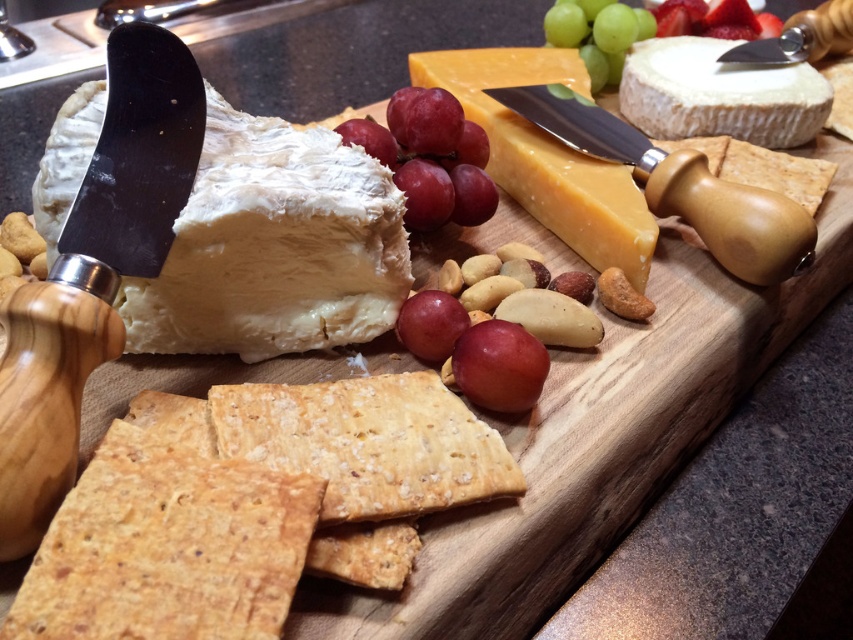
Is hard yellow cheese at center bigger than green matte grape at upper center?

Correct, hard yellow cheese at center is larger in size than green matte grape at upper center.

The height and width of the screenshot is (640, 853). Find the location of `hard yellow cheese at center`. hard yellow cheese at center is located at coordinates pos(547,156).

At what (x,y) coordinates should I click in order to perform the action: click on hard yellow cheese at center. Please return your answer as a coordinate pair (x, y). Looking at the image, I should click on (547, 156).

Who is more distant from viewer, (604, 172) or (714, 58)?

Positioned behind is point (714, 58).

Can you confirm if hard yellow cheese at center is wider than white creamy cheese at upper right?

Correct, the width of hard yellow cheese at center exceeds that of white creamy cheese at upper right.

This screenshot has height=640, width=853. I want to click on hard yellow cheese at center, so [x=547, y=156].

Consider the image. Between white creamy cheese at left and shiny purple grapes at center, which one has less height?

shiny purple grapes at center is shorter.

Based on the photo, does white creamy cheese at left appear on the left side of shiny purple grapes at center?

Yes, white creamy cheese at left is to the left of shiny purple grapes at center.

Is point (381, 301) positioned in front of point (408, 344)?

No, (381, 301) is further to viewer.

Find the location of `white creamy cheese at left`. white creamy cheese at left is located at coordinates (274, 246).